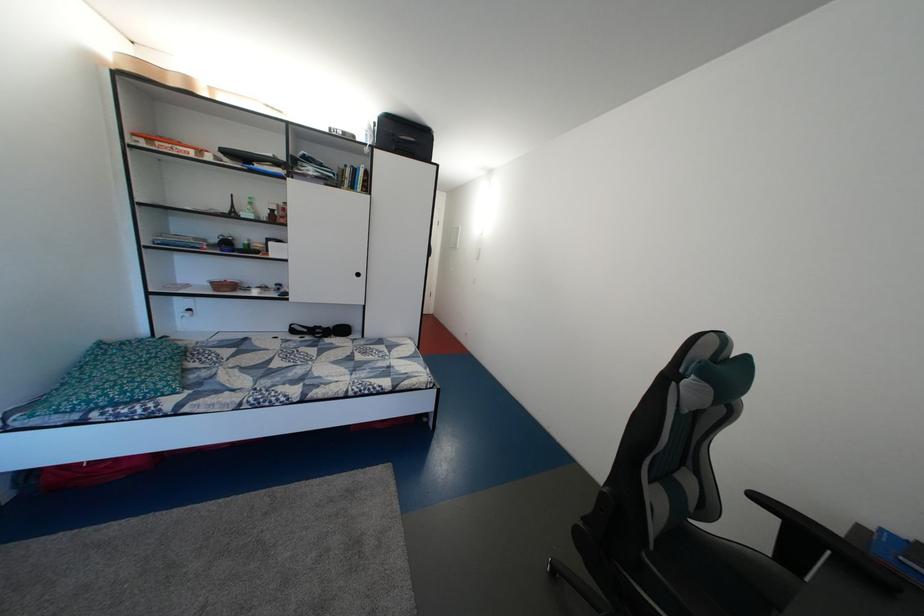
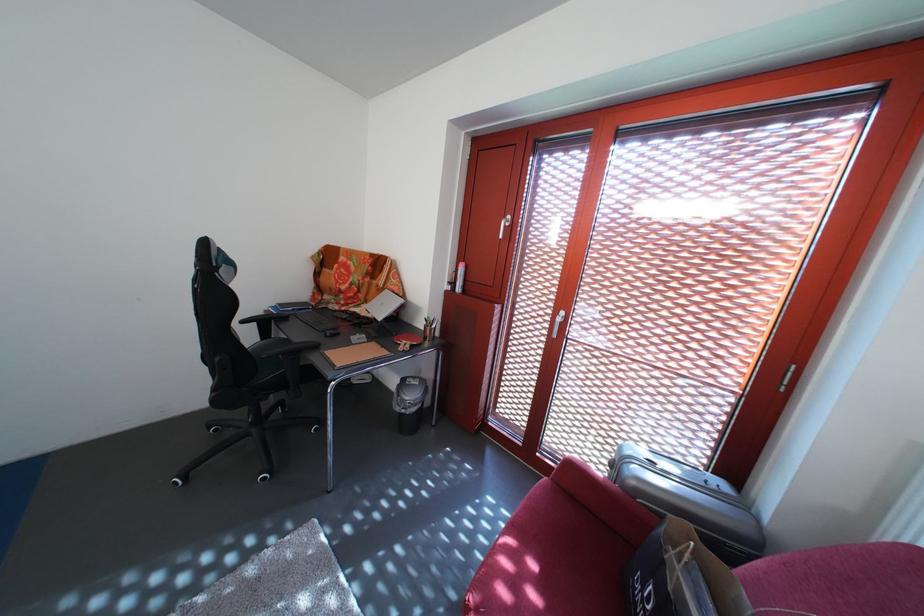
The point at [803,561] is marked in the first image. Where is the corresponding point in the second image?

(275, 339)